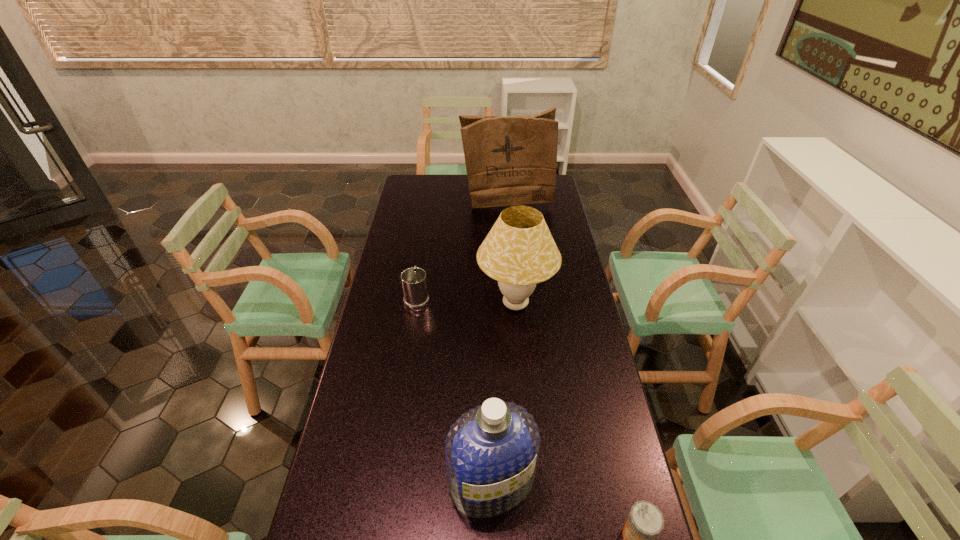
At what (x,y) coordinates should I click in order to perform the action: click on the tallest object. Please return your answer as a coordinate pair (x, y). The image size is (960, 540). Looking at the image, I should click on (509, 160).

Image resolution: width=960 pixels, height=540 pixels. In order to click on the farthest object in this screenshot , I will do `click(509, 160)`.

Locate an element on the screen. lampshade is located at coordinates (519, 251).

Locate an element on the screen. cleansing agent is located at coordinates (491, 452).

Identify the location of the second shortest object. Image resolution: width=960 pixels, height=540 pixels. (414, 282).

The image size is (960, 540). Find the location of `the leftmost object`. the leftmost object is located at coordinates [x=414, y=282].

Find the location of a particular element. This screenshot has height=540, width=960. free space located on the back of the tallest object is located at coordinates (505, 178).

I want to click on vacant space positioned on the back of the lampshade, so click(510, 232).

The width and height of the screenshot is (960, 540). Identify the location of vacant region located on the right of the cleansing agent. (558, 483).

Identify the location of vacant space situated 0.300m on the side of the mug with the handle. This screenshot has height=540, width=960. (426, 239).